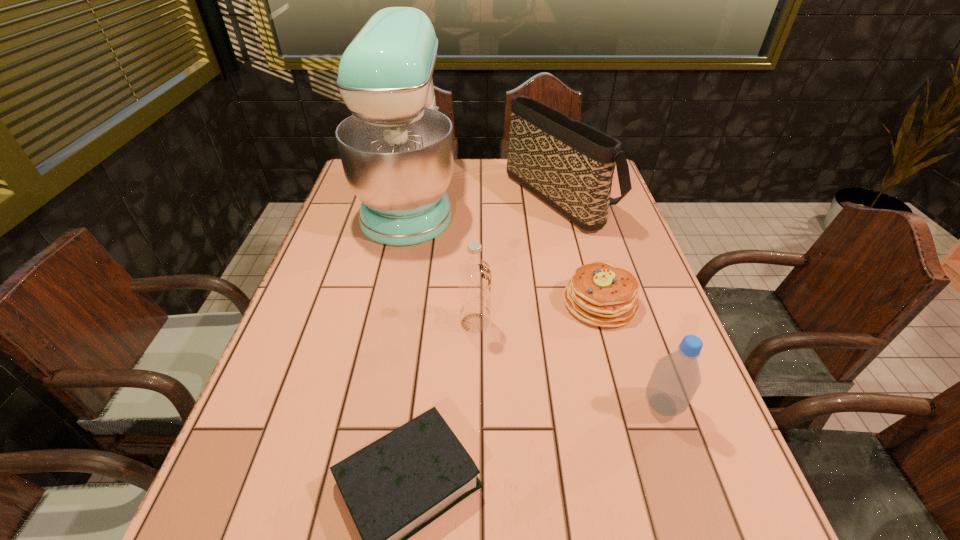
Identify the location of mixer that is positioned at the far edge. (396, 150).

Where is `handbag positioned at the far edge`? This screenshot has width=960, height=540. handbag positioned at the far edge is located at coordinates (569, 165).

You are a GUI agent. You are given a task and a screenshot of the screen. Output one action in this format:
    pyautogui.click(x=<x>, y=<y>)
    Task: Click on the object that is at the left edge
    This screenshot has height=540, width=960.
    Given the screenshot: What is the action you would take?
    click(x=396, y=150)

This screenshot has width=960, height=540. Find the location of `handbag that is positioned at the right edge`. handbag that is positioned at the right edge is located at coordinates (569, 165).

Locate an element on the screen. This screenshot has width=960, height=540. bottle that is at the right edge is located at coordinates (676, 377).

I want to click on pancake present at the right edge, so click(x=598, y=293).

The image size is (960, 540). What are the coordinates of `object that is at the far left corner` in the screenshot? It's located at 396,150.

Image resolution: width=960 pixels, height=540 pixels. I want to click on object located at the far right corner, so click(569, 165).

Image resolution: width=960 pixels, height=540 pixels. I want to click on vacant point at the far edge, so [x=516, y=187].

Image resolution: width=960 pixels, height=540 pixels. Identify the location of free space at the left edge of the desktop. (313, 382).